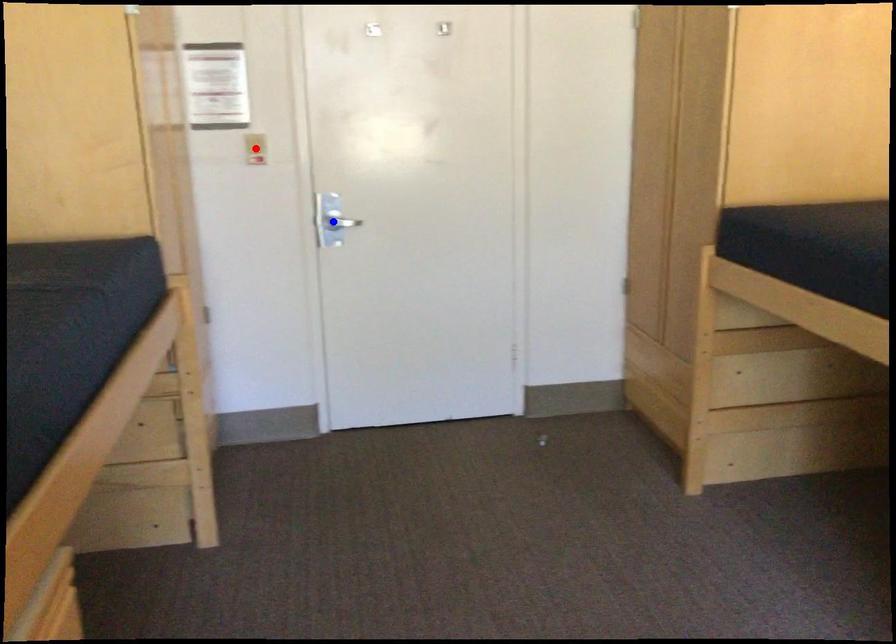
Question: Two points are marked on the image. Which point is closer to the camera?

Choices:
 (A) Blue point is closer.
 (B) Red point is closer.

Answer: (B)